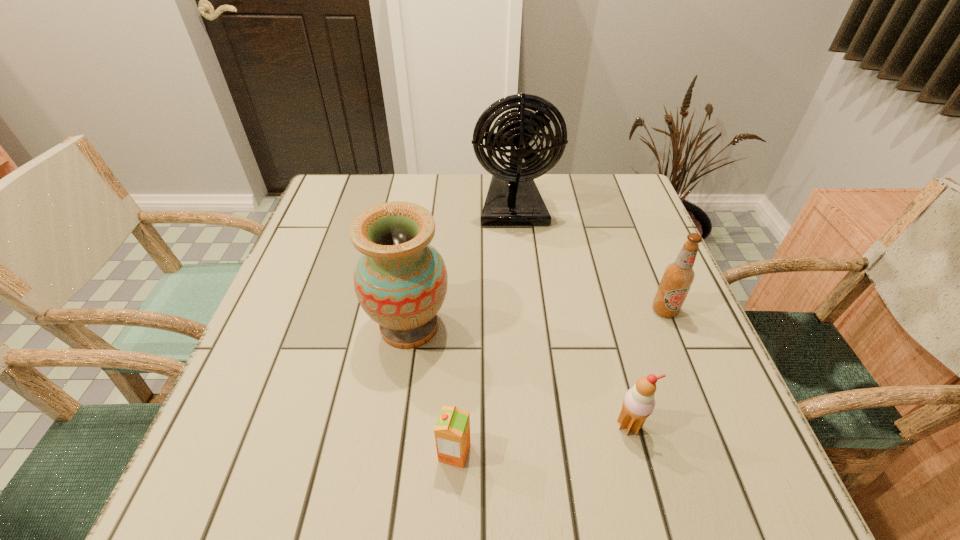
Where is `vacant region at the far left corner of the desktop`? vacant region at the far left corner of the desktop is located at coordinates (370, 180).

Identify the location of vacant space at the near left corner of the desktop. The width and height of the screenshot is (960, 540). (284, 483).

This screenshot has height=540, width=960. In the image, there is a desktop. Identify the location of free region at the near right corner. (722, 492).

At what (x,y) coordinates should I click in order to perform the action: click on free spot between the second shortest object and the orange juice. Please return your answer as a coordinate pair (x, y). This screenshot has height=540, width=960. Looking at the image, I should click on (541, 439).

Locate an element on the screen. This screenshot has width=960, height=540. empty space that is in between the tallest object and the rightmost object is located at coordinates (589, 258).

The width and height of the screenshot is (960, 540). Identify the location of vacant space in between the second shortest object and the shortest object. (541, 439).

You are a GUI agent. You are given a task and a screenshot of the screen. Output one action in this format:
    pyautogui.click(x=<x>, y=<y>)
    Task: Click on the vacant area that lies between the rightmost object and the vase
    
    Given the screenshot: What is the action you would take?
    pyautogui.click(x=537, y=318)

At what (x,y) coordinates should I click in order to perform the action: click on free space between the second tallest object and the fourth tallest object. Please return your answer as a coordinate pair (x, y). The width and height of the screenshot is (960, 540). Looking at the image, I should click on (519, 376).

Find the location of a particular element. empty location between the fourth shortest object and the second object from right to left is located at coordinates (519, 376).

Locate an element on the screen. free space between the shortest object and the fourth shortest object is located at coordinates (432, 389).